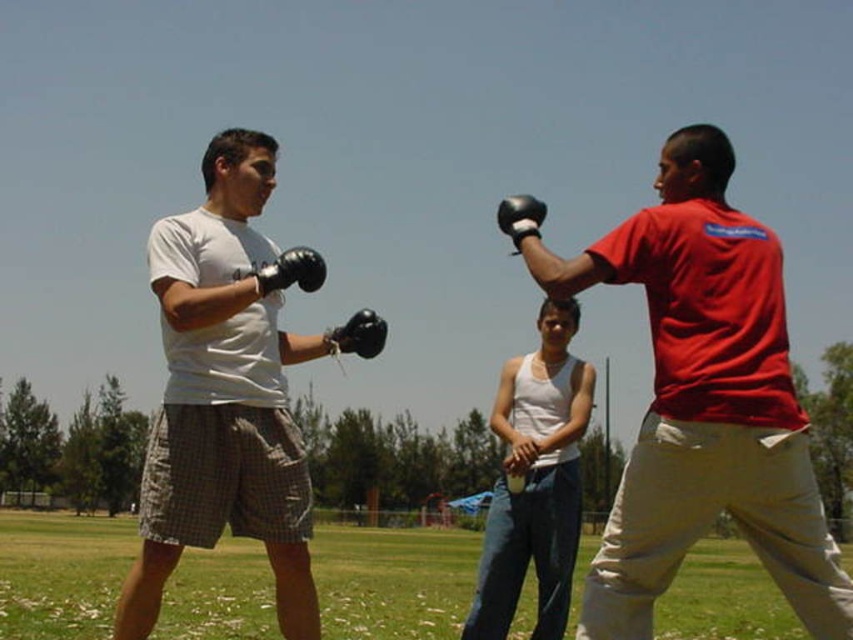
You are a sports equipment inspector checking the boxing gloves in the image. The gloves must meet a minimum height requirement of 10 cm. You observe the black matte boxing glove at left and the black matte boxing glove at center. Which glove meets the height requirement?

The black matte boxing glove at left has a greater height compared to the black matte boxing glove at center. Since the minimum requirement is 10 cm, if either glove meets the requirement, the glove at left would be the one that does.